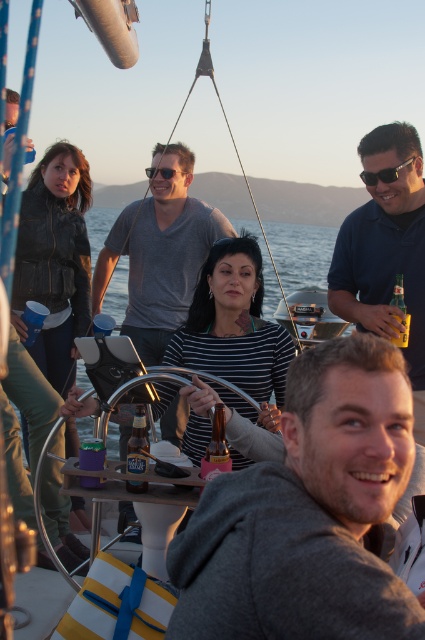
How far apart are gray hoodie at center and blue polo shirt at upper right?

They are 2.73 meters apart.

From the picture: Is gray hoodie at center to the left of blue polo shirt at upper right from the viewer's perspective?

Yes, gray hoodie at center is to the left of blue polo shirt at upper right.

Between point (408, 388) and point (371, 132), which one is positioned behind?

Point (371, 132)

Identify the location of gray hoodie at center. Image resolution: width=425 pixels, height=640 pixels. (308, 513).

Based on the photo, who is more distant from viewer, (410, 193) or (209, 248)?

The point (209, 248) is more distant.

Based on the photo, can you confirm if blue polo shirt at upper right is taller than matte gray shirt at center?

In fact, blue polo shirt at upper right may be shorter than matte gray shirt at center.

Which is in front, point (390, 294) or point (144, 320)?

Point (390, 294)

Locate an element on the screen. blue polo shirt at upper right is located at coordinates (385, 250).

Does blue polo shirt at upper right have a lesser height compared to translucent glass bottle at center?

No.

Where is `blue polo shirt at upper right`? This screenshot has width=425, height=640. blue polo shirt at upper right is located at coordinates (385, 250).

Where is `blue polo shirt at upper right`? The height and width of the screenshot is (640, 425). blue polo shirt at upper right is located at coordinates (385, 250).